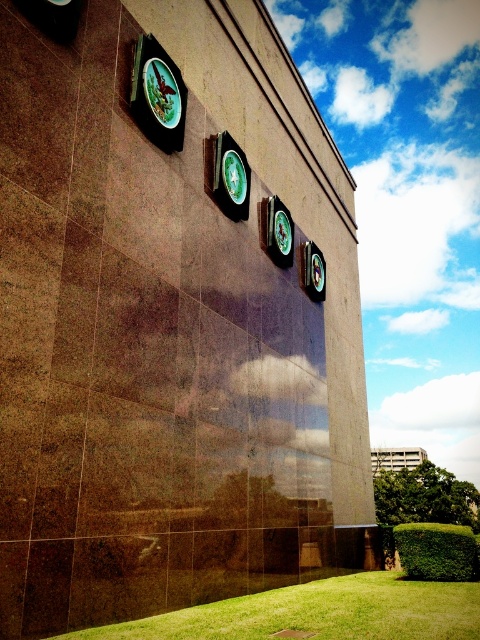
Who is shorter, matte green clock at upper left or green glossy clock at center?

green glossy clock at center is shorter.

Looking at this image, between matte green clock at upper left and green glossy clock at center, which one appears on the right side from the viewer's perspective?

green glossy clock at center

Find the location of a particular element. Image resolution: width=480 pixels, height=640 pixels. matte green clock at upper left is located at coordinates (157, 93).

Based on the photo, does green grass at lower center have a smaller size compared to matte green clock at upper left?

Indeed, green grass at lower center has a smaller size compared to matte green clock at upper left.

Does green grass at lower center appear on the left side of matte green clock at upper left?

In fact, green grass at lower center is to the right of matte green clock at upper left.

The width and height of the screenshot is (480, 640). Describe the element at coordinates (319, 612) in the screenshot. I see `green grass at lower center` at that location.

Image resolution: width=480 pixels, height=640 pixels. I want to click on green grass at lower center, so click(319, 612).

Which of these two, green grass at lower center or green glossy clock at center, stands shorter?

green grass at lower center is shorter.

Between point (425, 636) and point (232, 214), which one is positioned in front?

Point (425, 636)

The width and height of the screenshot is (480, 640). I want to click on green grass at lower center, so click(x=319, y=612).